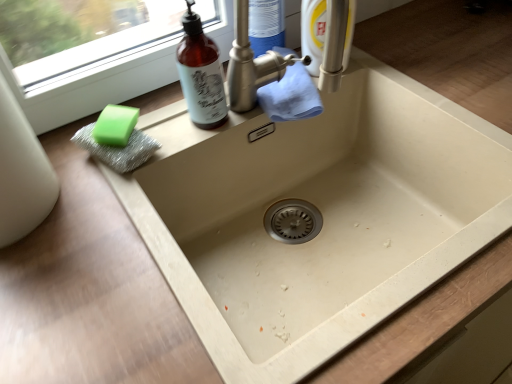
Image resolution: width=512 pixels, height=384 pixels. Find the location of `vacant area situated to the left side of brown glass bottle at upper left`. vacant area situated to the left side of brown glass bottle at upper left is located at coordinates (143, 127).